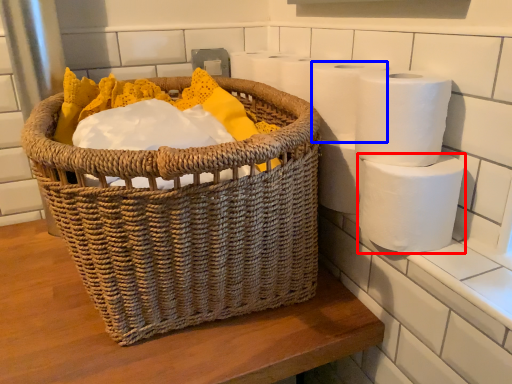
Question: Which point is further to the camera, toilet paper (highlighted by a red box) or toilet paper (highlighted by a blue box)?

Choices:
 (A) toilet paper
 (B) toilet paper

Answer: (B)